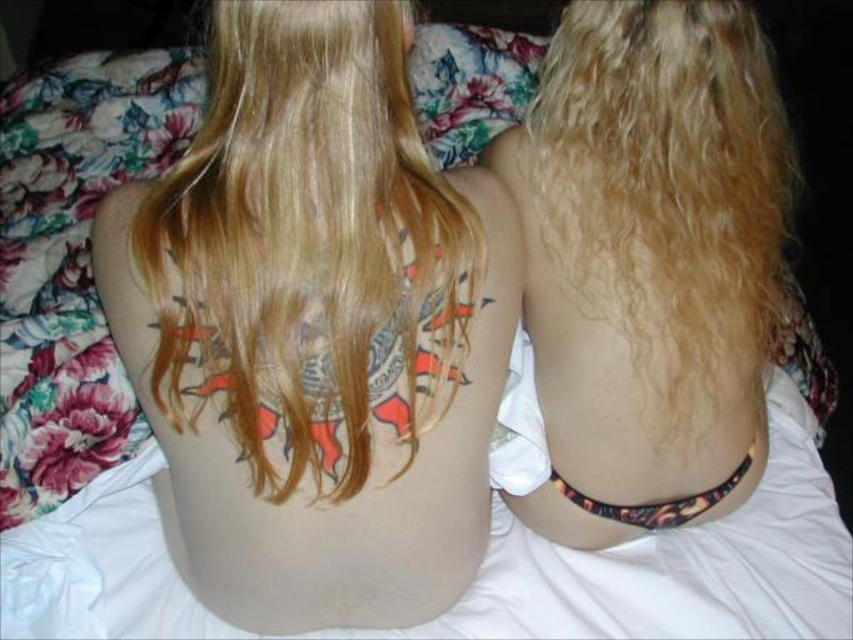
Based on the scene description, which object is wider, the blonde hair at upper left or the multicolored ink tattoo at lower center?

The blonde hair at upper left is wider than the multicolored ink tattoo at lower center according to the description.

You are a photographer trying to capture a closeup shot of the blonde hair at upper left. Your camera has a minimum focusing distance of 25 inches. Can you take the photo without moving closer than the minimum distance?

The distance between you and the blonde hair at upper left is 28.40 inches, which is greater than the camera minimum focusing distance of 25 inches. Therefore, you can take the photo without moving closer than the minimum distance.